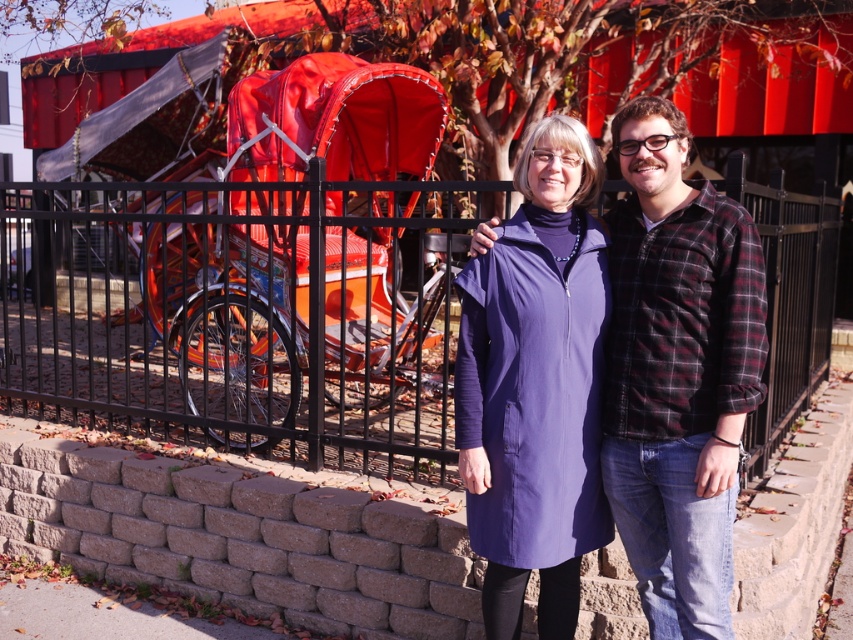
This screenshot has width=853, height=640. Identify the location of black metal fence at center. (239, 310).

Image resolution: width=853 pixels, height=640 pixels. What are the coordinates of `black metal fence at center` in the screenshot? It's located at (239, 310).

Is purple matte coat at center to the right of purple smooth coat at center from the viewer's perspective?

Yes, purple matte coat at center is to the right of purple smooth coat at center.

Does purple matte coat at center have a greater width compared to purple smooth coat at center?

Incorrect, purple matte coat at center's width does not surpass purple smooth coat at center's.

Locate an element on the screen. Image resolution: width=853 pixels, height=640 pixels. purple matte coat at center is located at coordinates (677, 371).

Where is `purple matte coat at center`? This screenshot has width=853, height=640. purple matte coat at center is located at coordinates (677, 371).

Does black metal fence at center appear on the right side of purple matte coat at center?

No, black metal fence at center is not to the right of purple matte coat at center.

Between black metal fence at center and purple matte coat at center, which one appears on the right side from the viewer's perspective?

From the viewer's perspective, purple matte coat at center appears more on the right side.

The height and width of the screenshot is (640, 853). What are the coordinates of `black metal fence at center` in the screenshot? It's located at (239, 310).